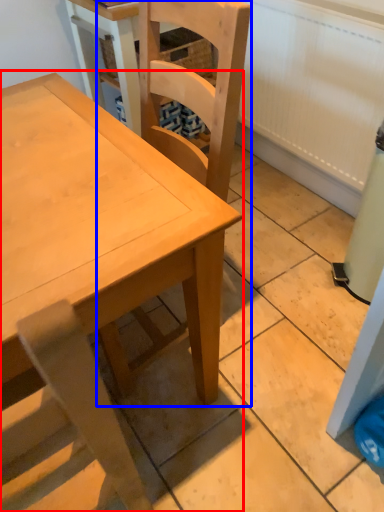
Question: Which of the following is the farthest to the observer, table (highlighted by a red box) or chair (highlighted by a blue box)?

Choices:
 (A) table
 (B) chair

Answer: (B)